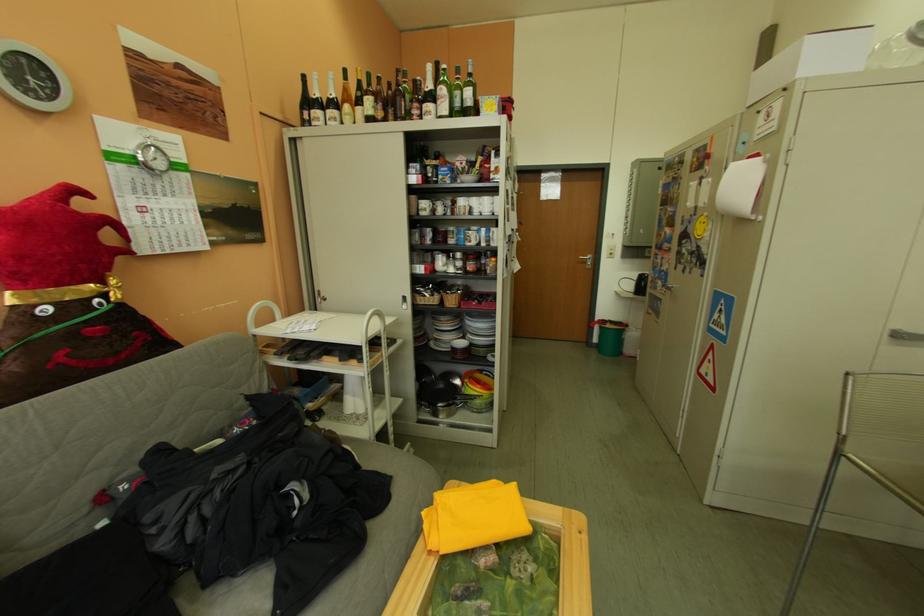
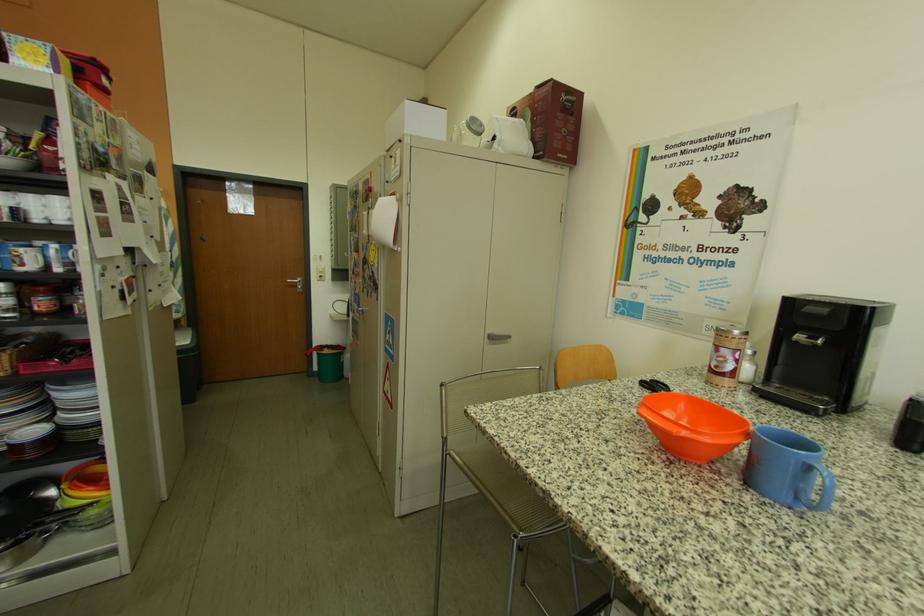
Where in the second image is the point corresponding to (x=613, y=330) from the first image?

(331, 357)